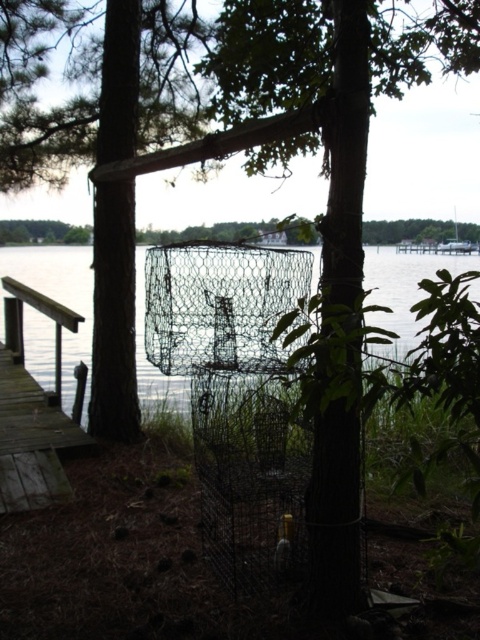
Does metallic wire basket at center appear on the right side of wooden dock at left?

Indeed, metallic wire basket at center is positioned on the right side of wooden dock at left.

Between point (399, 340) and point (37, 444), which one is positioned behind?

The point (399, 340) is more distant.

Where is `metallic wire basket at center`? Image resolution: width=480 pixels, height=640 pixels. metallic wire basket at center is located at coordinates (59, 296).

Can you confirm if wire mesh net at center is thinner than metallic wire basket at center?

No, wire mesh net at center is not thinner than metallic wire basket at center.

Which is behind, point (188, 296) or point (147, 376)?

The point (147, 376) is behind.

Describe the element at coordinates (220, 305) in the screenshot. I see `wire mesh net at center` at that location.

Where is `wire mesh net at center`? The image size is (480, 640). wire mesh net at center is located at coordinates (220, 305).

Does wire mesh net at center have a lesser width compared to wooden dock at left?

Correct, wire mesh net at center's width is less than wooden dock at left's.

Between point (250, 250) and point (26, 477), which one is positioned in front?

Positioned in front is point (250, 250).

Where is `wire mesh net at center`? This screenshot has width=480, height=640. wire mesh net at center is located at coordinates (220, 305).